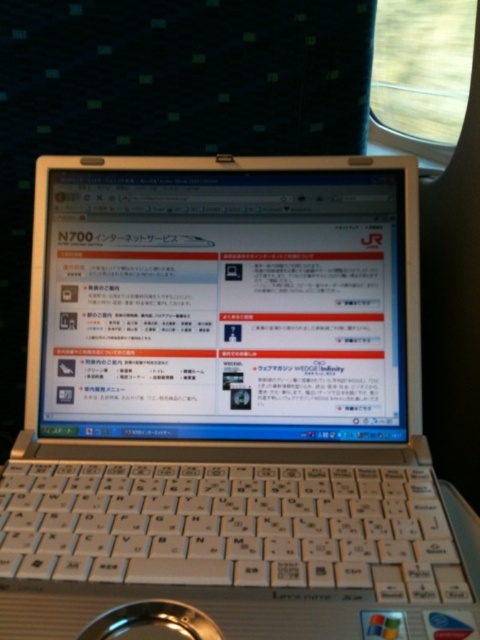
Can you confirm if white glossy laptop at center is positioned to the left of metallic silver magnifying glass at lower center?

No, white glossy laptop at center is not to the left of metallic silver magnifying glass at lower center.

From the picture: Measure the distance from white glossy laptop at center to metallic silver magnifying glass at lower center.

white glossy laptop at center is 11.96 inches away from metallic silver magnifying glass at lower center.

In order to click on white glossy laptop at center in this screenshot , I will do `click(225, 305)`.

Who is shorter, white glossy laptop at center or white plastic keyboard at center?

white plastic keyboard at center

Is the position of white glossy laptop at center more distant than that of white plastic keyboard at center?

Yes, white glossy laptop at center is further from the viewer.

Looking at this image, measure the distance between white glossy laptop at center and camera.

white glossy laptop at center is 22.32 inches away from camera.

At what (x,y) coordinates should I click in order to perform the action: click on white glossy laptop at center. Please return your answer as a coordinate pair (x, y). Looking at the image, I should click on (225, 305).

Is the position of white plastic keyboard at center more distant than that of metallic silver magnifying glass at lower center?

Yes, white plastic keyboard at center is behind metallic silver magnifying glass at lower center.

Who is taller, white plastic keyboard at center or metallic silver magnifying glass at lower center?

white plastic keyboard at center

What do you see at coordinates (230, 528) in the screenshot? I see `white plastic keyboard at center` at bounding box center [230, 528].

I want to click on white plastic keyboard at center, so click(230, 528).